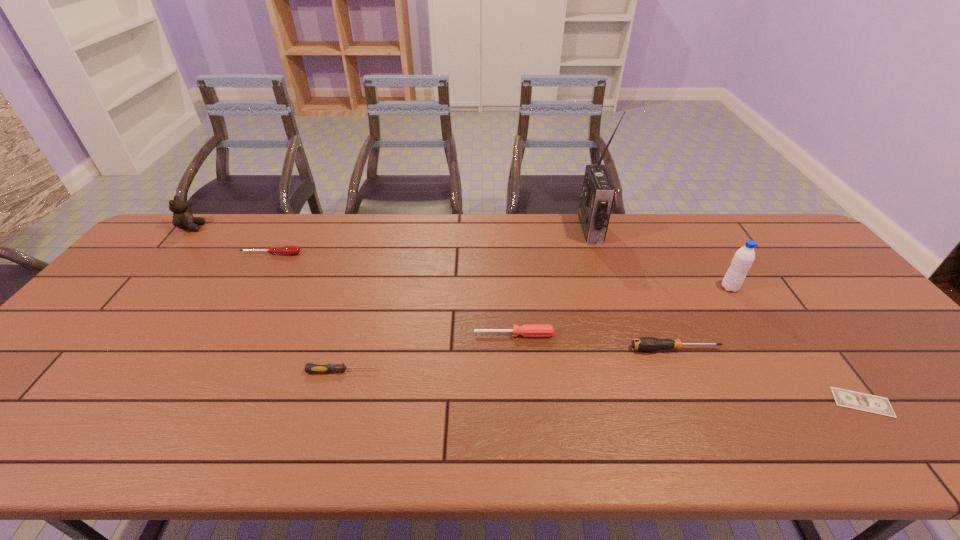
Find the location of a particular element. The image size is (960, 540). the tallest object is located at coordinates (598, 192).

At what (x,y) coordinates should I click in order to perform the action: click on the second object from right to left. Please return your answer as a coordinate pair (x, y). This screenshot has width=960, height=540. Looking at the image, I should click on (744, 257).

At what (x,y) coordinates should I click in order to perform the action: click on the fourth farthest object. Please return your answer as a coordinate pair (x, y). Looking at the image, I should click on (744, 257).

Where is `teddy bear`? The height and width of the screenshot is (540, 960). teddy bear is located at coordinates (182, 217).

You are a GUI agent. You are given a task and a screenshot of the screen. Output one action in this format:
    pyautogui.click(x=<x>, y=<y>)
    Task: Click on the sixth shortest object
    Image resolution: width=960 pixels, height=540 pixels.
    Given the screenshot: What is the action you would take?
    pyautogui.click(x=182, y=217)

At what (x,y) coordinates should I click in order to perform the action: click on the fifth shortest object. Please return your answer as a coordinate pair (x, y). Looking at the image, I should click on (644, 343).

Locate an element on the screen. the third farthest screwdriver is located at coordinates (644, 343).

Find the location of a particular element. This screenshot has width=960, height=540. the third farthest object is located at coordinates [x=288, y=250].

The image size is (960, 540). Identify the location of the seventh object from right to left. (288, 250).

Where is `the third nearest screwdriver`? the third nearest screwdriver is located at coordinates (527, 330).